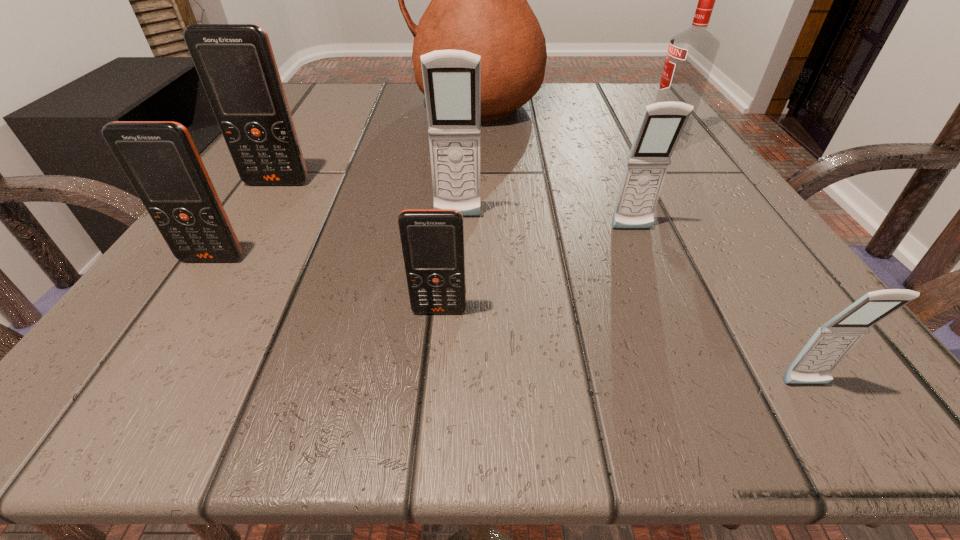
Image resolution: width=960 pixels, height=540 pixels. I want to click on vacant space at the near edge of the desktop, so click(380, 394).

This screenshot has height=540, width=960. In the image, there is a desktop. Identify the location of vacant space at the left edge. (356, 142).

Find the location of a particular element. The height and width of the screenshot is (540, 960). free space at the right edge is located at coordinates (708, 226).

You are a GUI agent. You are given a task and a screenshot of the screen. Output one action in this format:
    pyautogui.click(x=<x>, y=<y>)
    Task: Click on the free space at the far left corner
    
    Given the screenshot: What is the action you would take?
    pyautogui.click(x=300, y=116)

Locate an element on the screen. The height and width of the screenshot is (540, 960). blank area at the far right corner is located at coordinates (606, 100).

What are the coordinates of `free space at the near right corner of the desktop` in the screenshot? It's located at (733, 352).

This screenshot has height=540, width=960. What are the coordinates of `vacant area that lies between the red vodka and the tallest object` in the screenshot? It's located at (570, 124).

Image resolution: width=960 pixels, height=540 pixels. I want to click on vacant area that lies between the smallest orange cellular telephone and the second gray cellular telephone from left to right, so click(536, 270).

Where is `free space between the nearest gray cellular telephone and the second smallest orange cellular telephone`? Image resolution: width=960 pixels, height=540 pixels. free space between the nearest gray cellular telephone and the second smallest orange cellular telephone is located at coordinates (509, 322).

I want to click on vacant space in between the nearest object and the third nearest cellular telephone, so click(509, 322).